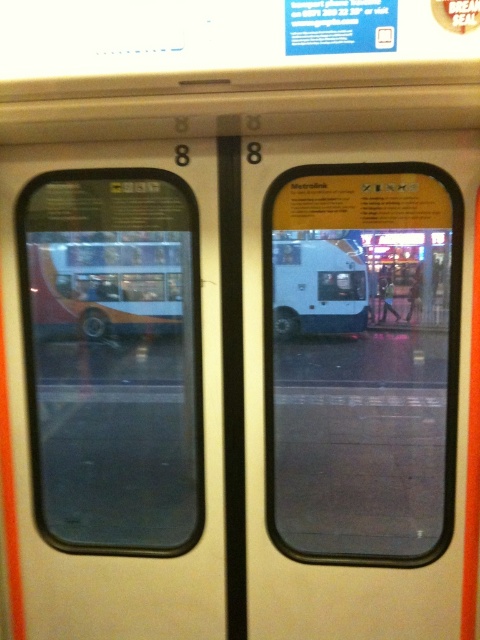
You are a passenger on the train and want to know which object, the transparent glass window at left or the white matte bus at right, has a greater width as seen from your seat. What do you observe?

The transparent glass window at left has a greater width than the white matte bus at right as seen from your seat.

You are a passenger on the train and want to know if the transparent glass window at right can provide a better view of the white matte bus at right compared to the other window. Which window should you look through?

The transparent glass window at right is larger in size than the white matte bus at right, so looking through the transparent glass window at right would provide a better view of the white matte bus at right.